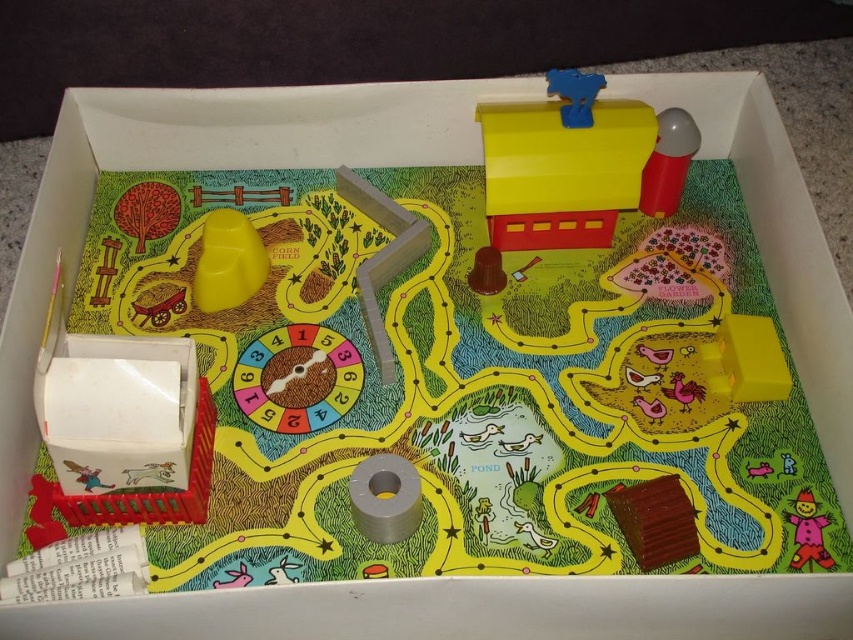
From the picture: Does matte plastic mailbox at upper right appear on the left side of matte pink scarecrow at lower right?

Yes, matte plastic mailbox at upper right is to the left of matte pink scarecrow at lower right.

Between point (676, 129) and point (822, 513), which one is positioned in front?

Point (822, 513) is more forward.

Locate an element on the screen. The width and height of the screenshot is (853, 640). matte plastic mailbox at upper right is located at coordinates (578, 164).